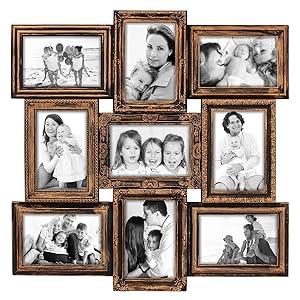
The image size is (300, 300). I want to click on picture frames, so click(31, 30), click(119, 24), click(194, 57), click(207, 137), click(195, 141), click(92, 155), click(105, 216), click(180, 229), click(282, 232).